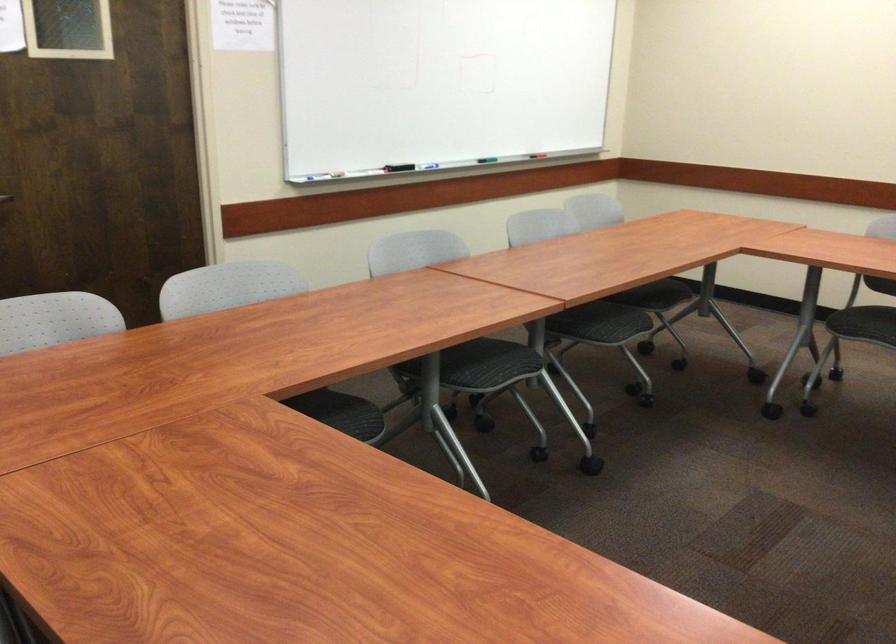
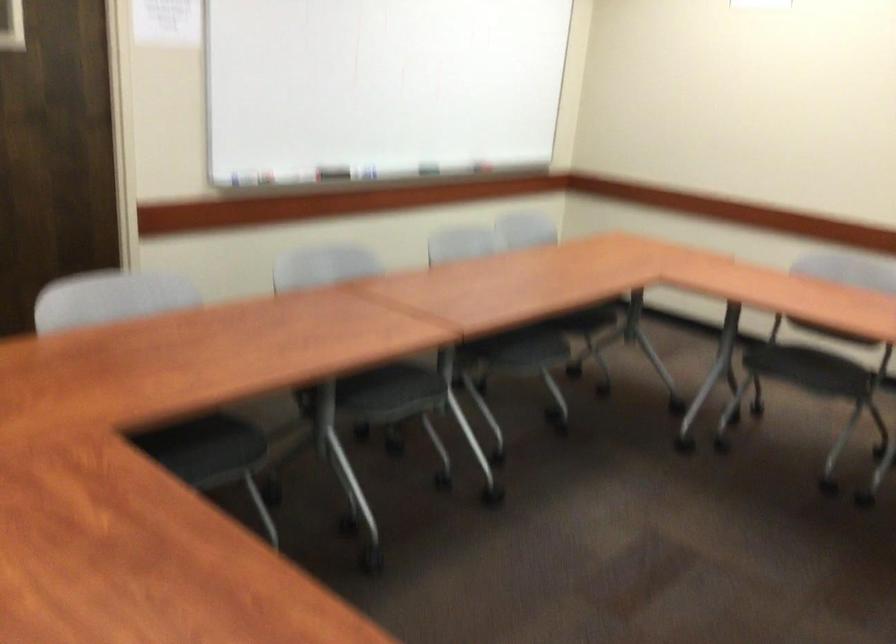
Question: Which direction would the cameraman need to move to produce the second image? Reply with the corresponding letter.

Choices:
 (A) Left
 (B) Right
 (C) Forward
 (D) Backward

Answer: (B)